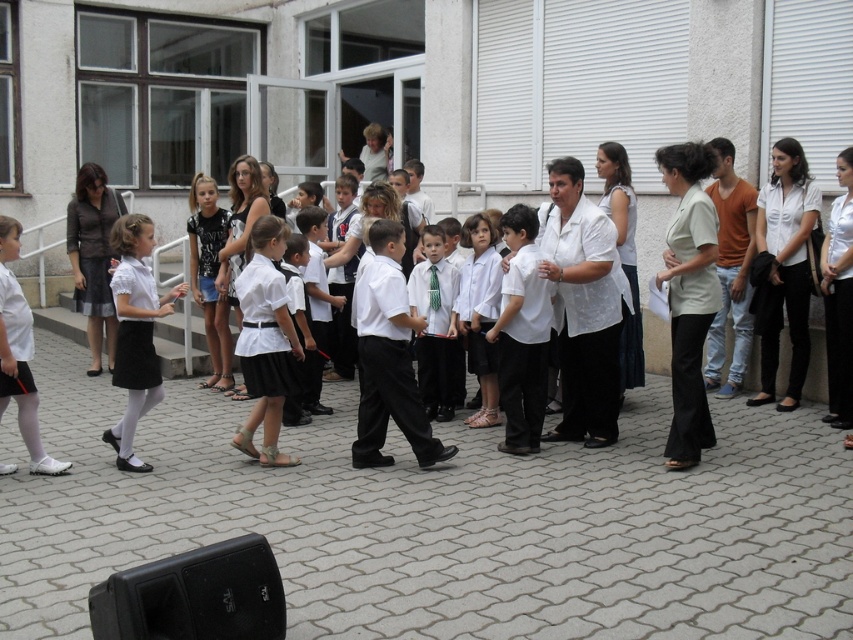
Question: Which point is closer to the camera?

Choices:
 (A) (682, 161)
 (B) (457, 321)
 (C) (122, 275)
 (D) (430, 397)

Answer: (A)

Question: Is beige fabric blouse at center smaller than white cotton dress at center?

Choices:
 (A) no
 (B) yes

Answer: (A)

Question: Which of the following is the closest to the observer?

Choices:
 (A) (527, 259)
 (B) (155, 397)
 (C) (688, 232)

Answer: (C)

Question: Is beige fabric blouse at center wider than matte white blouse at center?

Choices:
 (A) no
 (B) yes

Answer: (A)

Question: Is beige fabric blouse at center above white cotton dress at center?

Choices:
 (A) yes
 (B) no

Answer: (A)

Question: Which point is farther to the camera?

Choices:
 (A) (138, 241)
 (B) (10, 381)
 (C) (115, 333)

Answer: (C)